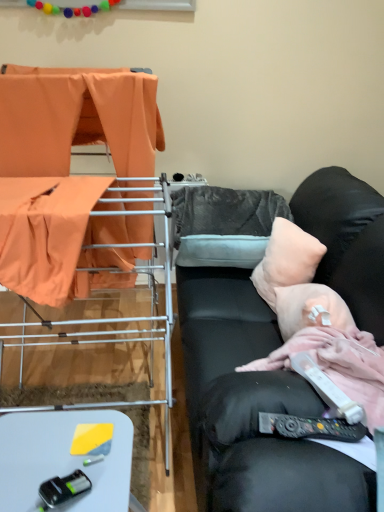
The height and width of the screenshot is (512, 384). Identify the location of vacant location behind black plastic toy car at lower left, the second equipment viewed from the right. (74, 445).